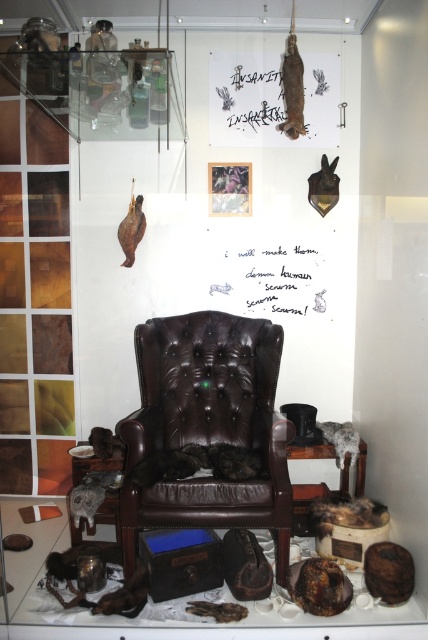
Is brown leather armchair at center wider than white paper at center?

Yes, brown leather armchair at center is wider than white paper at center.

Which is more to the left, brown leather armchair at center or white paper at center?

Positioned to the left is brown leather armchair at center.

Does point (287, 420) come behind point (309, 276)?

No, (287, 420) is closer to viewer.

Find the location of a particular element. This screenshot has height=640, width=428. brown leather armchair at center is located at coordinates (208, 426).